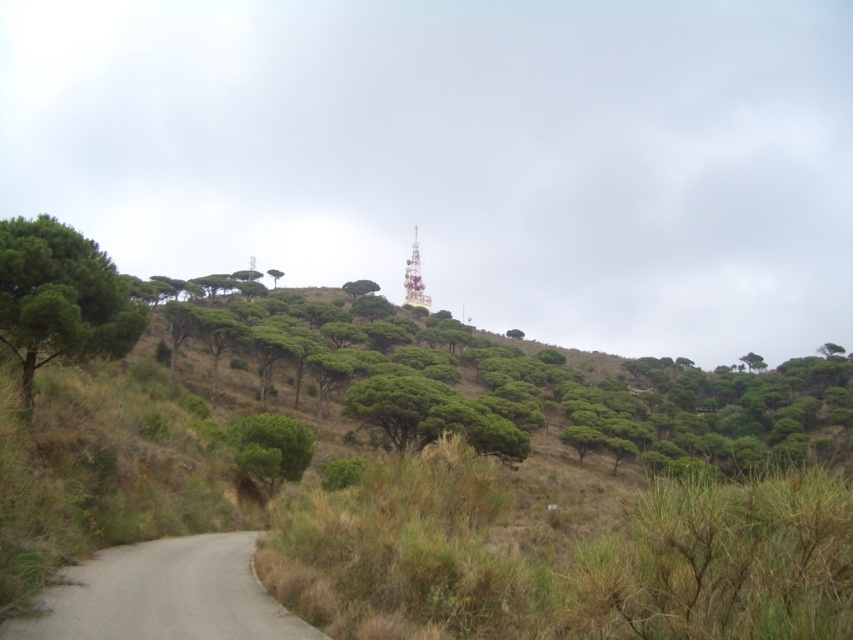
You are a hiker standing at the base of the hill and want to reach the telecommunications tower on the hill. You see the gray gravel road at lower left and the green leafy tree at left. Which object should you prioritize following or avoiding to reach your destination efficiently?

You should prioritize following the gray gravel road at lower left since it is closer to you than the green leafy tree at left, indicating it might be a more direct path towards the telecommunications tower on the hill.

You are a surveyor trying to locate the green leafy tree at upper center in the image. According to the coordinates provided, where exactly is it positioned?

The green leafy tree at upper center is located at point [540,387].